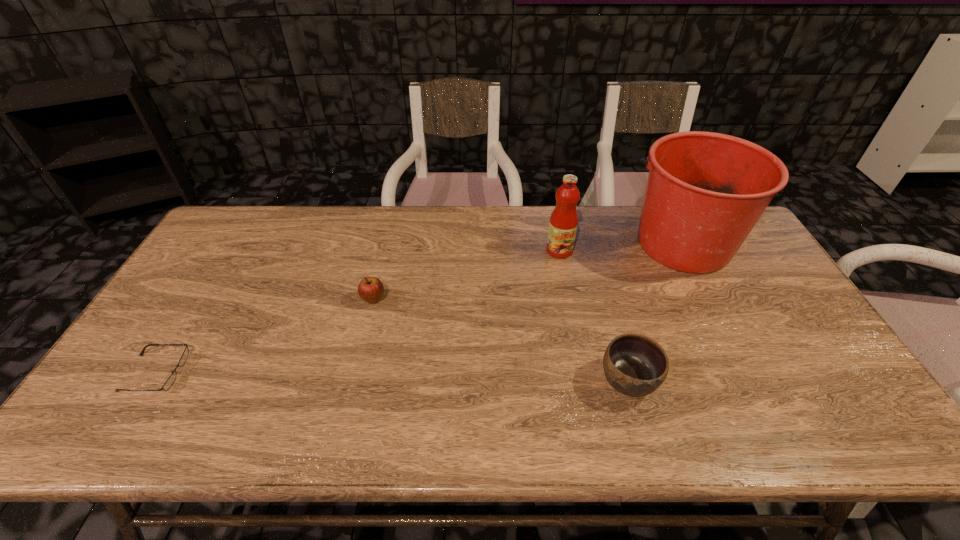
You are a GUI agent. You are given a task and a screenshot of the screen. Output one action in this format:
    pyautogui.click(x=<x>, y=<y>)
    Task: Click on the free space that is in between the bowl and the fruit juice
    This screenshot has height=540, width=960.
    Given the screenshot: What is the action you would take?
    pyautogui.click(x=593, y=315)

This screenshot has width=960, height=540. Find the location of `object that can be found as the second closest to the rightmost object`. object that can be found as the second closest to the rightmost object is located at coordinates (634, 364).

Locate which object ranks fourth in proximity to the fruit juice. Please provide its 2D coordinates. Your answer should be formatted as a tuple, i.e. [(x, y)], where the tuple contains the x and y coordinates of a point satisfying the conditions above.

[(182, 361)]

Where is `free location that satisfies the following two spatial constraints: 1. on the front-facing side of the leftmost object; 2. on the left side of the bowl`? free location that satisfies the following two spatial constraints: 1. on the front-facing side of the leftmost object; 2. on the left side of the bowl is located at coordinates (151, 380).

The height and width of the screenshot is (540, 960). I want to click on vacant region that satisfies the following two spatial constraints: 1. on the front label of the bowl; 2. on the left side of the fruit juice, so click(x=585, y=380).

Locate an element on the screen. The height and width of the screenshot is (540, 960). vacant space that satisfies the following two spatial constraints: 1. on the back side of the bowl; 2. on the right side of the rightmost object is located at coordinates (590, 244).